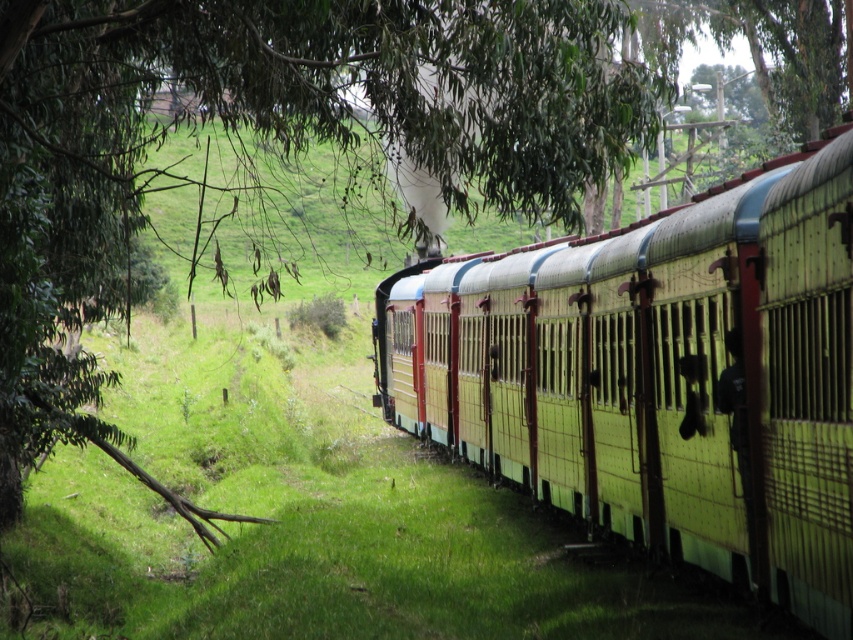
Question: Observing the image, what is the correct spatial positioning of yellow painted metal train at center in reference to green leafy tree at center?

Choices:
 (A) above
 (B) below

Answer: (B)

Question: Among these objects, which one is farthest from the camera?

Choices:
 (A) yellow painted metal train at center
 (B) green leafy tree at center

Answer: (A)

Question: In this image, where is yellow painted metal train at center located relative to green leafy tree at center?

Choices:
 (A) above
 (B) below

Answer: (B)

Question: Can you confirm if yellow painted metal train at center is thinner than green leafy tree at center?

Choices:
 (A) no
 (B) yes

Answer: (B)